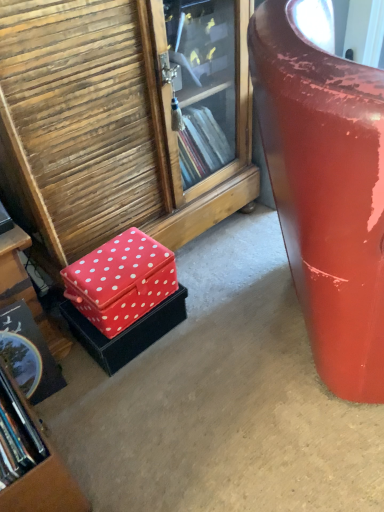
Question: From a real-world perspective, does wooden bookcase at lower left sit lower than red fabric box at lower left?

Choices:
 (A) yes
 (B) no

Answer: (B)

Question: From the image's perspective, is wooden bookcase at lower left on red fabric box at lower left?

Choices:
 (A) yes
 (B) no

Answer: (B)

Question: Is wooden bookcase at lower left with red fabric box at lower left?

Choices:
 (A) no
 (B) yes

Answer: (A)

Question: From the image's perspective, does wooden bookcase at lower left appear lower than red fabric box at lower left?

Choices:
 (A) no
 (B) yes

Answer: (B)

Question: Is the position of wooden bookcase at lower left more distant than that of red fabric box at lower left?

Choices:
 (A) yes
 (B) no

Answer: (A)

Question: Considering the relative sizes of wooden bookcase at lower left and red fabric box at lower left in the image provided, is wooden bookcase at lower left taller than red fabric box at lower left?

Choices:
 (A) no
 (B) yes

Answer: (B)

Question: Is glossy red suitcase at right not close to red fabric box at lower left?

Choices:
 (A) no
 (B) yes

Answer: (A)

Question: Does glossy red suitcase at right appear on the right side of red fabric box at lower left?

Choices:
 (A) no
 (B) yes

Answer: (B)

Question: Considering the relative positions of glossy red suitcase at right and red fabric box at lower left in the image provided, is glossy red suitcase at right to the left of red fabric box at lower left from the viewer's perspective?

Choices:
 (A) yes
 (B) no

Answer: (B)

Question: Does glossy red suitcase at right have a lesser width compared to red fabric box at lower left?

Choices:
 (A) no
 (B) yes

Answer: (B)

Question: Is glossy red suitcase at right facing away from red fabric box at lower left?

Choices:
 (A) yes
 (B) no

Answer: (A)

Question: From the image's perspective, is glossy red suitcase at right over red fabric box at lower left?

Choices:
 (A) yes
 (B) no

Answer: (A)

Question: Considering the relative sizes of glossy red suitcase at right and red fabric box at lower left, placed as the first box when sorted from top to bottom, in the image provided, is glossy red suitcase at right thinner than red fabric box at lower left, placed as the first box when sorted from top to bottom,?

Choices:
 (A) no
 (B) yes

Answer: (A)